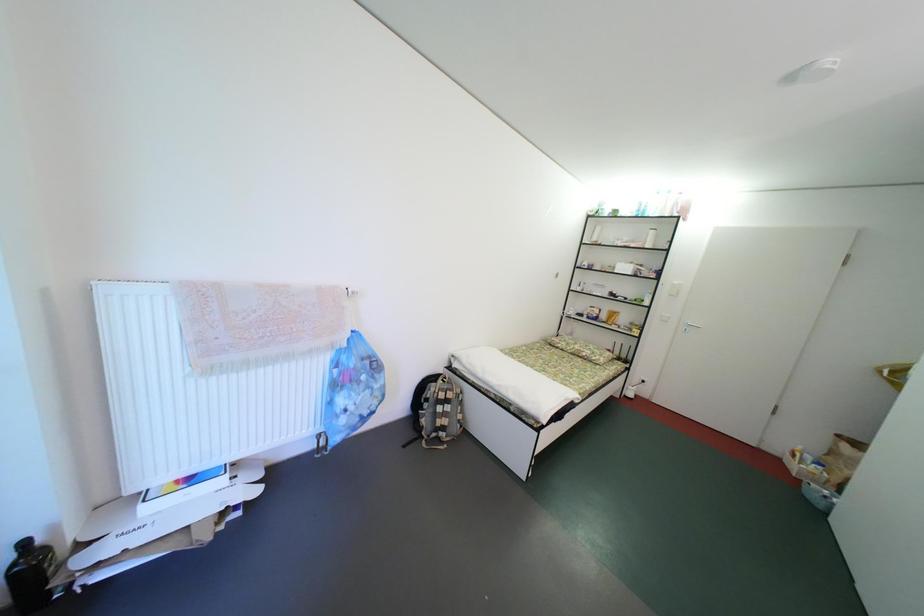
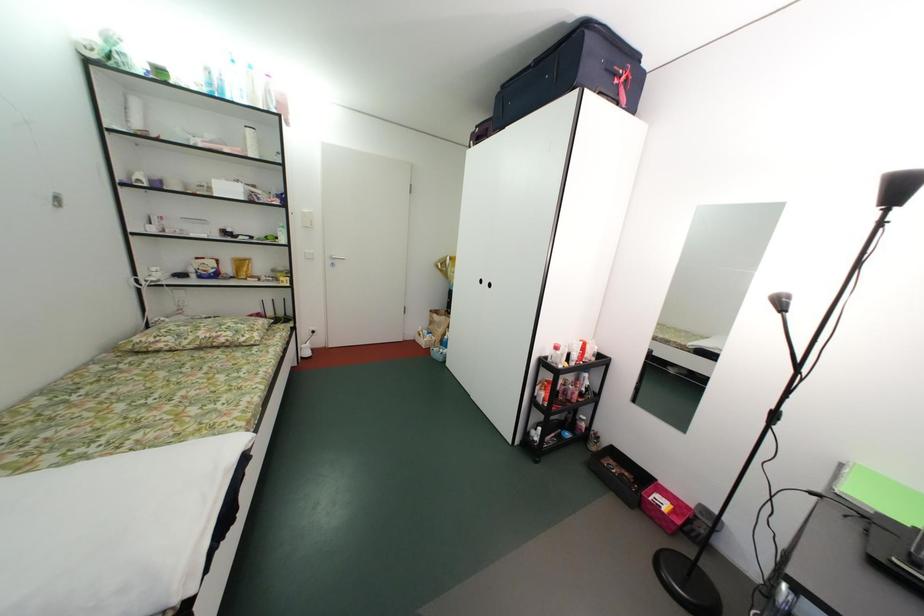
How did the camera likely rotate?

The camera's rotation is toward right-down.